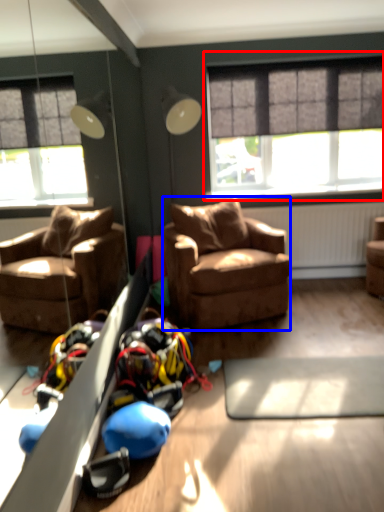
Question: Which object is closer to the camera taking this photo, window (highlighted by a red box) or studio couch (highlighted by a blue box)?

Choices:
 (A) window
 (B) studio couch

Answer: (B)